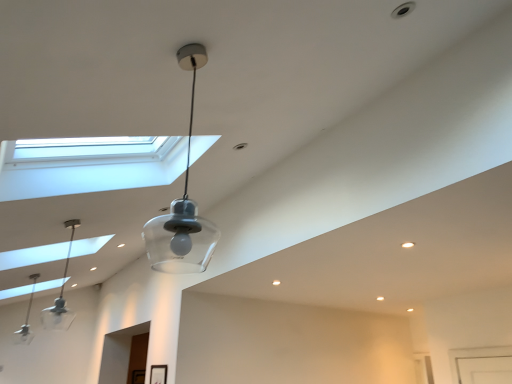
Question: From the image's perspective, is clear glass pendant light at left, positioned as the 1th lamp in left-to-right order, on clear glass pendant light at left, which is the 2th lamp from bottom to top?

Choices:
 (A) yes
 (B) no

Answer: (B)

Question: From a real-world perspective, is clear glass pendant light at left, arranged as the 1th lamp when ordered from the bottom, under clear glass pendant light at left, which is counted as the 2th lamp, starting from the left?

Choices:
 (A) yes
 (B) no

Answer: (B)

Question: Considering the relative positions of clear glass pendant light at left, positioned as the 1th lamp in left-to-right order, and clear glass pendant light at left, which is counted as the second lamp, starting from the right, in the image provided, is clear glass pendant light at left, positioned as the 1th lamp in left-to-right order, to the left of clear glass pendant light at left, which is counted as the second lamp, starting from the right, from the viewer's perspective?

Choices:
 (A) no
 (B) yes

Answer: (B)

Question: Does clear glass pendant light at left, arranged as the 1th lamp when ordered from the bottom, have a greater height compared to clear glass pendant light at left, which ranks as the second lamp in back-to-front order?

Choices:
 (A) no
 (B) yes

Answer: (B)

Question: From the image's perspective, is clear glass pendant light at left, positioned as the first lamp in back-to-front order, located beneath clear glass pendant light at left, the 2th lamp from the front?

Choices:
 (A) no
 (B) yes

Answer: (B)

Question: Can you confirm if clear glass pendant light at left, positioned as the 3th lamp in front-to-back order, is thinner than clear glass pendant light at left, which ranks as the second lamp in back-to-front order?

Choices:
 (A) yes
 (B) no

Answer: (B)

Question: Is clear glass pendant light at left, the 2th lamp from the front, to the left of clear glass pendant light at left, arranged as the 1th lamp when ordered from the bottom, from the viewer's perspective?

Choices:
 (A) yes
 (B) no

Answer: (B)

Question: Does clear glass pendant light at left, which is the 2th lamp from bottom to top, have a lesser height compared to clear glass pendant light at left, the third lamp in the top-to-bottom sequence?

Choices:
 (A) no
 (B) yes

Answer: (B)

Question: From the image's perspective, is clear glass pendant light at left, which ranks as the second lamp in back-to-front order, beneath clear glass pendant light at left, positioned as the first lamp in back-to-front order?

Choices:
 (A) no
 (B) yes

Answer: (A)

Question: Does clear glass pendant light at left, the 2th lamp from the front, have a lesser width compared to clear glass pendant light at left, the third lamp in the top-to-bottom sequence?

Choices:
 (A) no
 (B) yes

Answer: (B)

Question: Is clear glass pendant light at left, which ranks as the second lamp in back-to-front order, turned away from clear glass pendant light at left, the third lamp in the top-to-bottom sequence?

Choices:
 (A) no
 (B) yes

Answer: (A)

Question: Is clear glass pendant light at left, arranged as the 1th lamp when ordered from the bottom, completely or partially inside clear glass pendant light at left, which is counted as the 2th lamp, starting from the left?

Choices:
 (A) no
 (B) yes

Answer: (A)

Question: Is clear glass pendant light at left, which is the 2th lamp from bottom to top, in front of clear glass pendant light at center, which is the 3th lamp in back-to-front order?

Choices:
 (A) no
 (B) yes

Answer: (A)